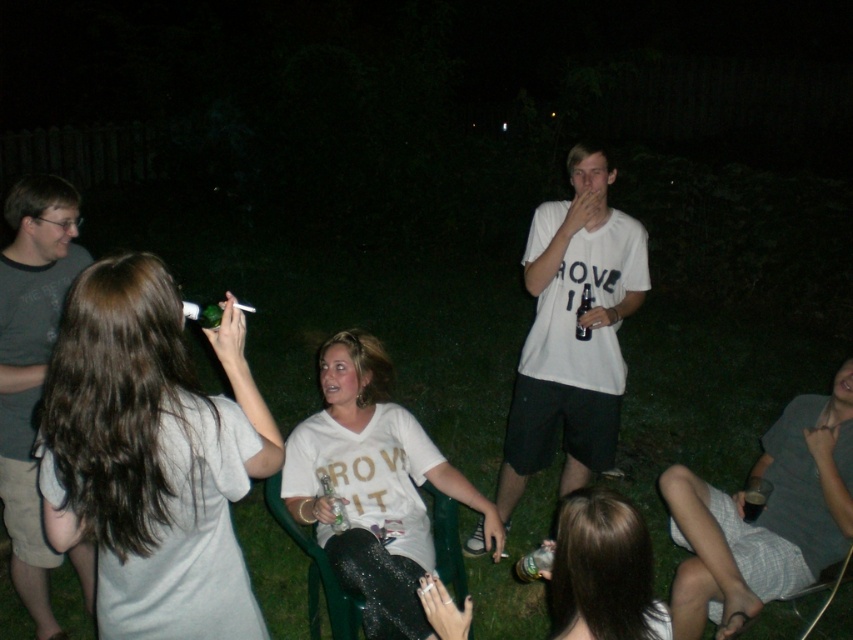
Which of these two, gray cotton shirt at lower right or matte white shirt at lower center, stands taller?

With more height is gray cotton shirt at lower right.

Which is below, gray cotton shirt at lower right or matte white shirt at lower center?

gray cotton shirt at lower right

I want to click on gray cotton shirt at lower right, so click(x=764, y=516).

Find the location of a particular element. gray cotton shirt at lower right is located at coordinates (764, 516).

Based on the photo, between gray cotton shirt at lower right and gray t-shirt at left, which one appears on the left side from the viewer's perspective?

Positioned to the left is gray t-shirt at left.

Does gray cotton shirt at lower right appear under gray t-shirt at left?

Yes.

Does point (775, 458) come farther from viewer compared to point (28, 465)?

Yes, point (775, 458) is farther from viewer.

The height and width of the screenshot is (640, 853). I want to click on gray cotton shirt at lower right, so click(764, 516).

Is matte gray shirt at upper left shorter than gray cotton shirt at lower right?

Correct, matte gray shirt at upper left is not as tall as gray cotton shirt at lower right.

Which is in front, point (115, 257) or point (769, 518)?

Positioned in front is point (115, 257).

Does point (154, 451) lie in front of point (759, 461)?

Yes, it is in front of point (759, 461).

Locate an element on the screen. This screenshot has height=640, width=853. matte gray shirt at upper left is located at coordinates (151, 456).